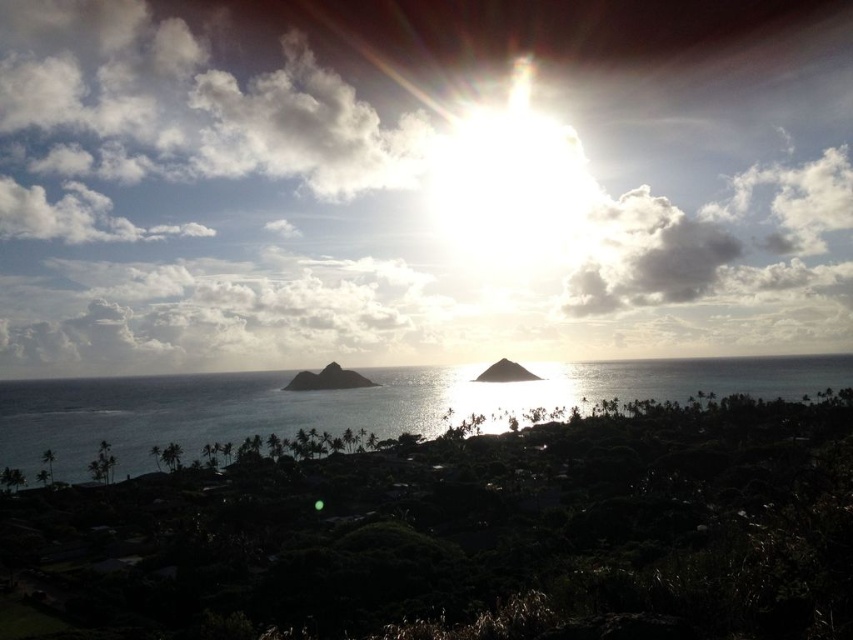
You are a drone operator trying to capture the smooth rock island at center in your shot. The clear blue water at center is blocking your view. Can you adjust your camera angle to avoid the water and still see the rock island?

The clear blue water at center has a larger size compared to smooth rock island at center, so it might be challenging to avoid the water entirely while still capturing the rock island. Adjusting the camera angle slightly upward or sideways could help reduce the water obstruction while keeping the rock island in frame.

You are a hiker who wants to cross from the smooth rock island at center to the dark brown soil at center. Given that your hiking boots have a maximum safe crossing distance of 70 meters, can you safely make this jump?

The smooth rock island at center is 74.20 meters from the dark brown soil at center. Since your hiking boots have a maximum safe crossing distance of 70 meters, the distance is too great, so you cannot safely make this jump.